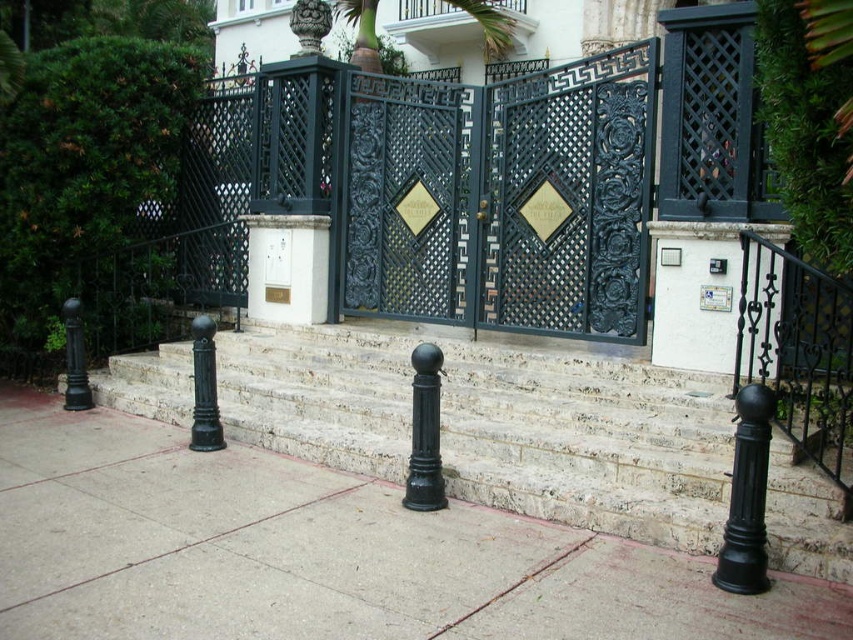
Question: Which is farther from the dark blue wrought iron gate at center?

Choices:
 (A) black wrought iron railing at right
 (B) black wrought iron gate at center
 (C) white marble stairs at center

Answer: (A)

Question: Can you confirm if white marble stairs at center is smaller than dark blue wrought iron gate at center?

Choices:
 (A) no
 (B) yes

Answer: (A)

Question: Which point is farther from the camera taking this photo?

Choices:
 (A) (364, 113)
 (B) (577, 522)

Answer: (A)

Question: Is white marble stairs at center wider than black wrought iron railing at right?

Choices:
 (A) no
 (B) yes

Answer: (B)

Question: Is white marble stairs at center further to the viewer compared to black wrought iron railing at right?

Choices:
 (A) no
 (B) yes

Answer: (B)

Question: Which point appears closest to the camera in this image?

Choices:
 (A) (778, 372)
 (B) (608, 481)
 (C) (619, 285)

Answer: (B)